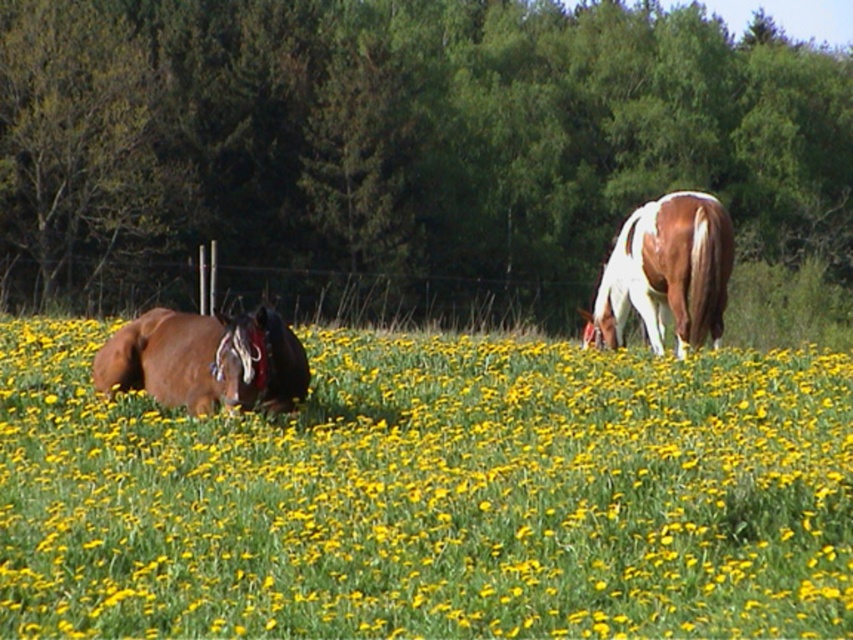
Can you confirm if yellow grass at center is positioned to the left of white-brown horse at right?

Correct, you'll find yellow grass at center to the left of white-brown horse at right.

Locate an element on the screen. yellow grass at center is located at coordinates pyautogui.click(x=431, y=496).

Locate an element on the screen. This screenshot has height=640, width=853. yellow grass at center is located at coordinates (431, 496).

Locate an element on the screen. This screenshot has height=640, width=853. yellow grass at center is located at coordinates (431, 496).

Is yellow grass at center thinner than brown glossy horse at left?

Yes.

Which is below, yellow grass at center or brown glossy horse at left?

yellow grass at center is lower down.

Who is more distant from viewer, (308, 438) or (190, 323)?

The point (190, 323) is behind.

In order to click on yellow grass at center in this screenshot , I will do `click(431, 496)`.

In the scene shown: Who is positioned more to the left, brown glossy horse at left or white-brown horse at right?

Positioned to the left is brown glossy horse at left.

Does brown glossy horse at left appear on the right side of white-brown horse at right?

Incorrect, brown glossy horse at left is not on the right side of white-brown horse at right.

Is point (132, 387) in front of point (619, 259)?

That is True.

At what (x,y) coordinates should I click in order to perform the action: click on brown glossy horse at left. Please return your answer as a coordinate pair (x, y). This screenshot has height=640, width=853. Looking at the image, I should click on (206, 360).